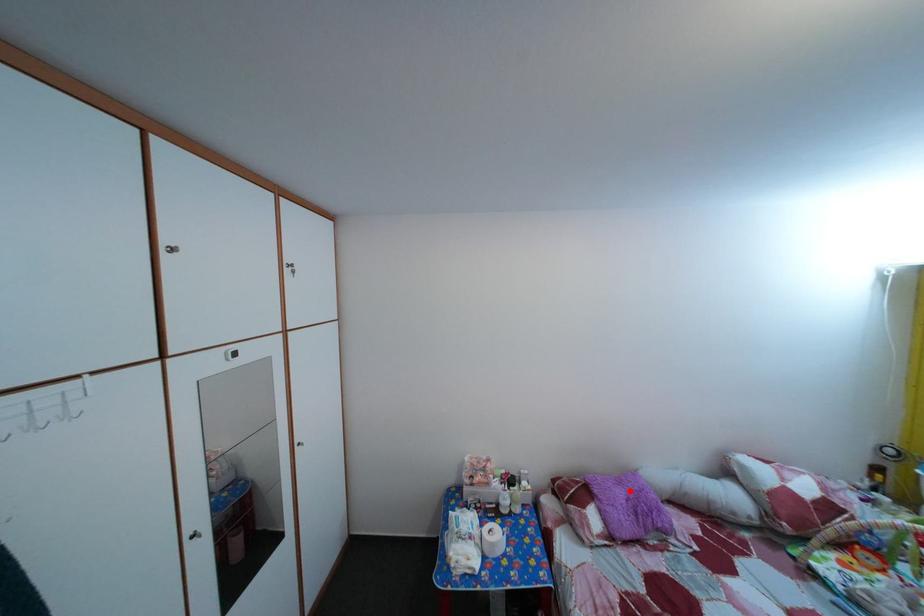
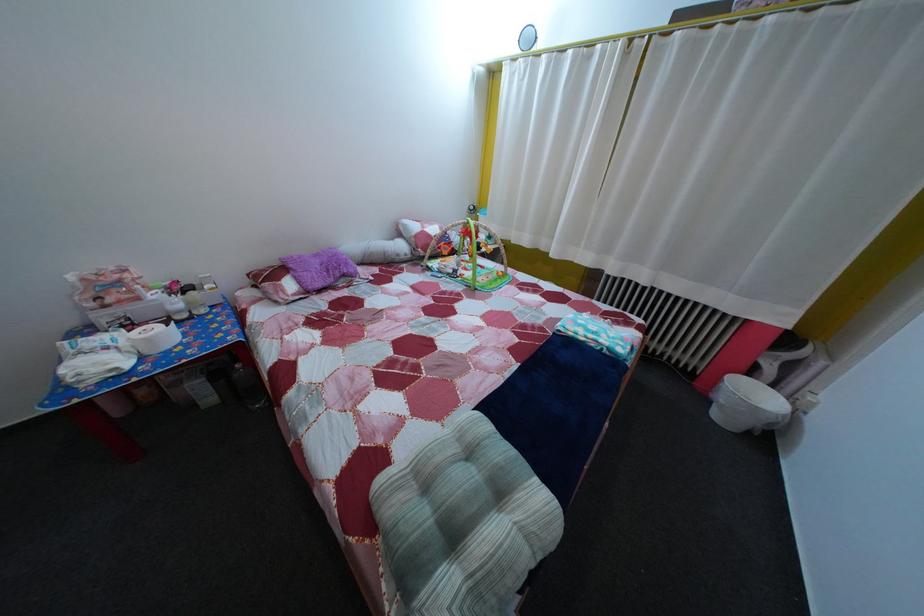
Question: I am providing you with two images of the same scene from different viewpoints. In image1, a red point is highlighted. Considering the same 3D point in image2, which of the following is correct?

Choices:
 (A) It is closer
 (B) It is farther

Answer: (A)